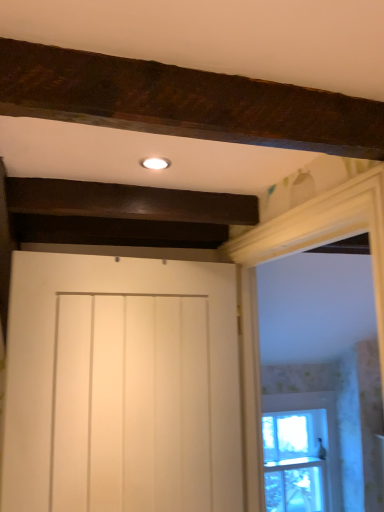
Question: Does white matte door at center have a smaller size compared to clear glass window at right?

Choices:
 (A) yes
 (B) no

Answer: (B)

Question: From a real-world perspective, is white matte door at center located higher than clear glass window at right?

Choices:
 (A) no
 (B) yes

Answer: (B)

Question: Is white matte door at center located outside clear glass window at right?

Choices:
 (A) yes
 (B) no

Answer: (A)

Question: Is white matte door at center closer to the viewer compared to clear glass window at right?

Choices:
 (A) yes
 (B) no

Answer: (A)

Question: Is white matte door at center thinner than clear glass window at right?

Choices:
 (A) no
 (B) yes

Answer: (A)

Question: Can you confirm if white matte door at center is taller than clear glass window at right?

Choices:
 (A) yes
 (B) no

Answer: (A)

Question: From a real-world perspective, is white wood frame at upper right physically above white matte door at center?

Choices:
 (A) no
 (B) yes

Answer: (B)

Question: Does white wood frame at upper right come in front of white matte door at center?

Choices:
 (A) yes
 (B) no

Answer: (A)

Question: Can you confirm if white wood frame at upper right is bigger than white matte door at center?

Choices:
 (A) no
 (B) yes

Answer: (B)

Question: Could you tell me if white wood frame at upper right is turned towards white matte door at center?

Choices:
 (A) yes
 (B) no

Answer: (A)

Question: Is white wood frame at upper right to the left of white matte door at center from the viewer's perspective?

Choices:
 (A) no
 (B) yes

Answer: (A)

Question: Would you say white wood frame at upper right contains white matte door at center?

Choices:
 (A) yes
 (B) no

Answer: (B)

Question: Can white wood frame at upper right be found inside clear glass window at right?

Choices:
 (A) yes
 (B) no

Answer: (B)